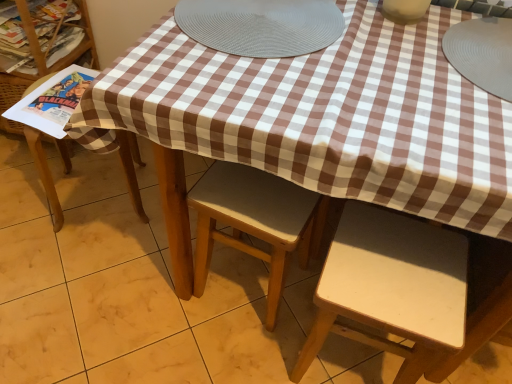
Locate an element on the screen. free space between light brown wood chair at center, which appears as the second chair when viewed from the left, and white matte chair at lower right, positioned as the 3th chair in left-to-right order is located at coordinates (265, 340).